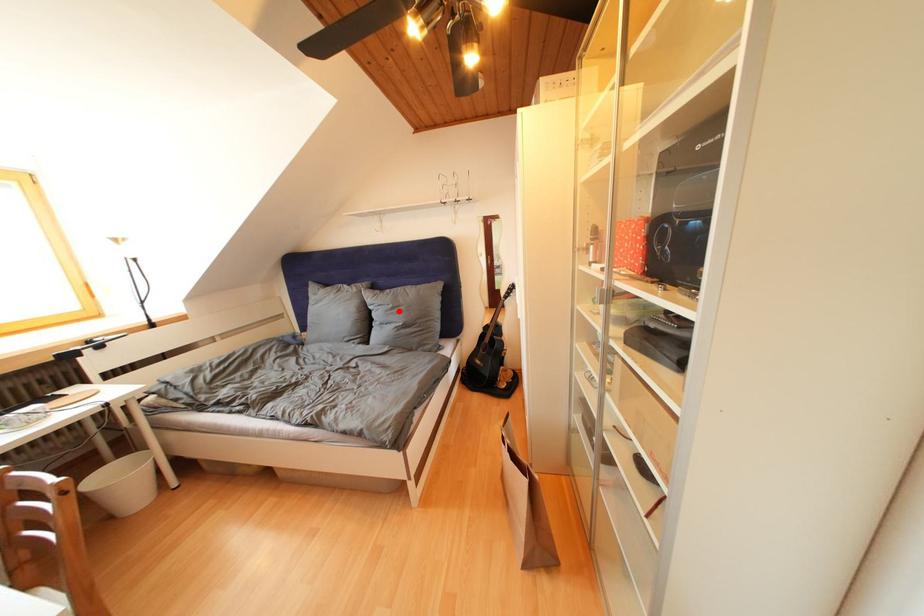
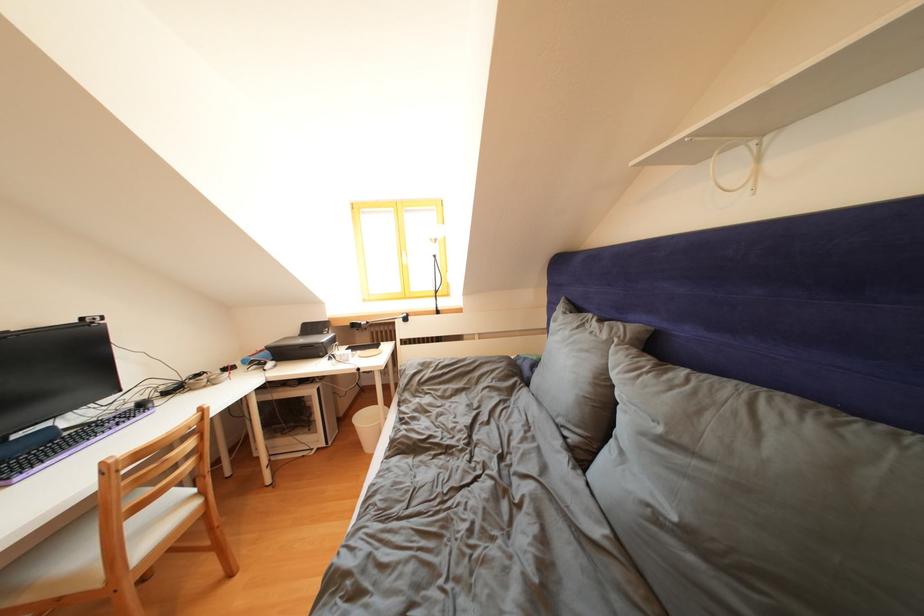
Locate, in the second image, the point that corresponds to the highlighted location in the first image.

(667, 435)